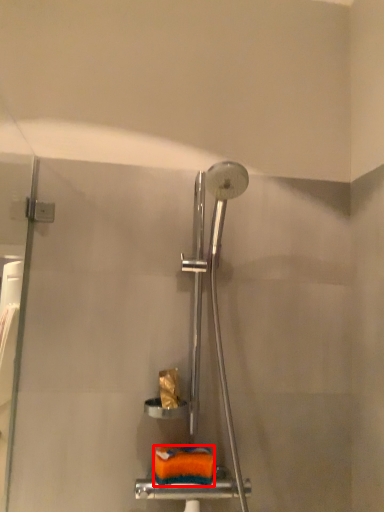
Question: From the image's perspective, where is material (annotated by the red box) located in relation to toilet paper in the image?

Choices:
 (A) above
 (B) below

Answer: (B)